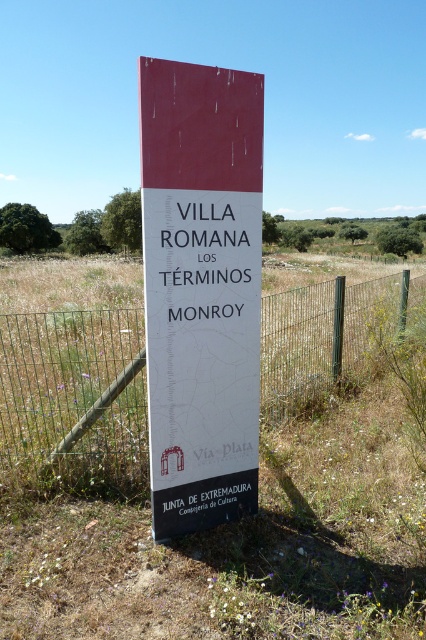
Question: Where is matte red sign at center located in relation to black metal pole at center in the image?

Choices:
 (A) right
 (B) left

Answer: (B)

Question: Which object is farther from the camera taking this photo?

Choices:
 (A) matte red sign at center
 (B) black metal pole at center
 (C) metal wire fence at center

Answer: (B)

Question: Which point appears farthest from the camera in this image?

Choices:
 (A) (77, 381)
 (B) (342, 301)
 (C) (213, 132)

Answer: (B)

Question: Does matte red sign at center have a greater width compared to black metal pole at center?

Choices:
 (A) yes
 (B) no

Answer: (A)

Question: Where is matte red sign at center located in relation to black metal pole at center in the image?

Choices:
 (A) left
 (B) right

Answer: (A)

Question: Which object is the farthest from the black metal pole at center?

Choices:
 (A) matte red sign at center
 (B) metal wire fence at center

Answer: (B)